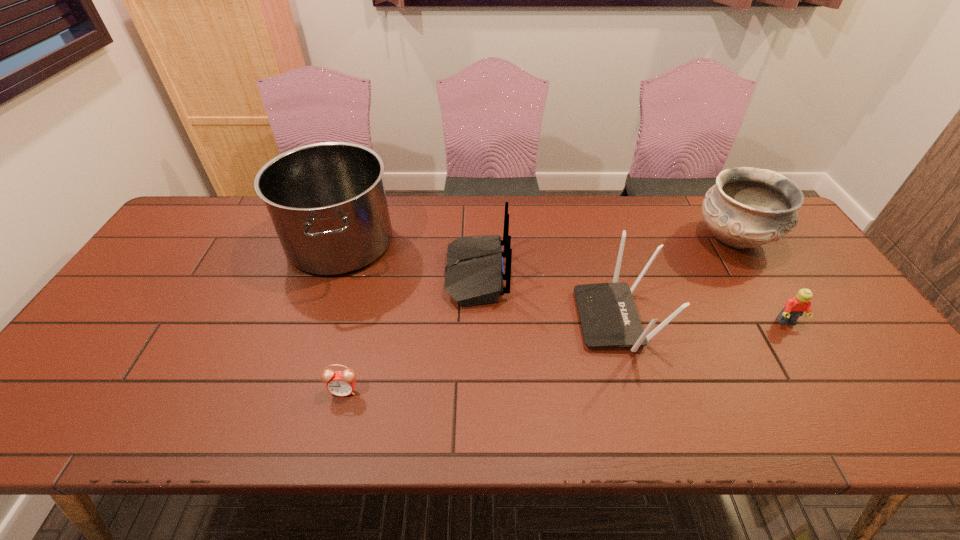
Where is `free spot between the Lego and the right router`? Image resolution: width=960 pixels, height=540 pixels. free spot between the Lego and the right router is located at coordinates (702, 320).

Identify the location of free space between the right router and the pottery. The image size is (960, 540). (675, 279).

Find the location of a particular element. object that stands as the fifth closest to the left router is located at coordinates (795, 307).

Identify which object is the fifth nearest to the right router. Please provide its 2D coordinates. Your answer should be formatted as a tuple, i.e. [(x, y)], where the tuple contains the x and y coordinates of a point satisfying the conditions above.

[(340, 383)]

This screenshot has width=960, height=540. Find the location of `vacant space that satisfies the following two spatial constraints: 1. on the front side of the pottery; 2. on the back of the left router`. vacant space that satisfies the following two spatial constraints: 1. on the front side of the pottery; 2. on the back of the left router is located at coordinates (756, 274).

I want to click on blank area in the image that satisfies the following two spatial constraints: 1. on the front side of the pottery; 2. on the front-facing side of the right router, so click(x=783, y=319).